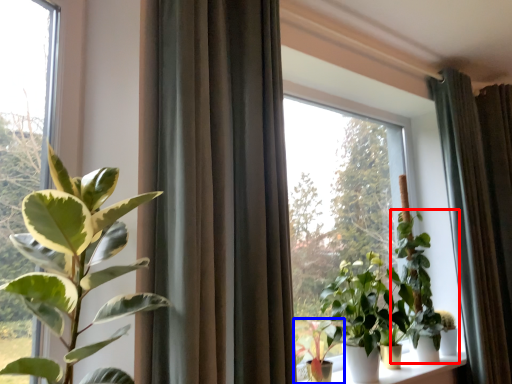
Question: Among these objects, which one is nearest to the camera, houseplant (highlighted by a red box) or houseplant (highlighted by a blue box)?

Choices:
 (A) houseplant
 (B) houseplant

Answer: (B)